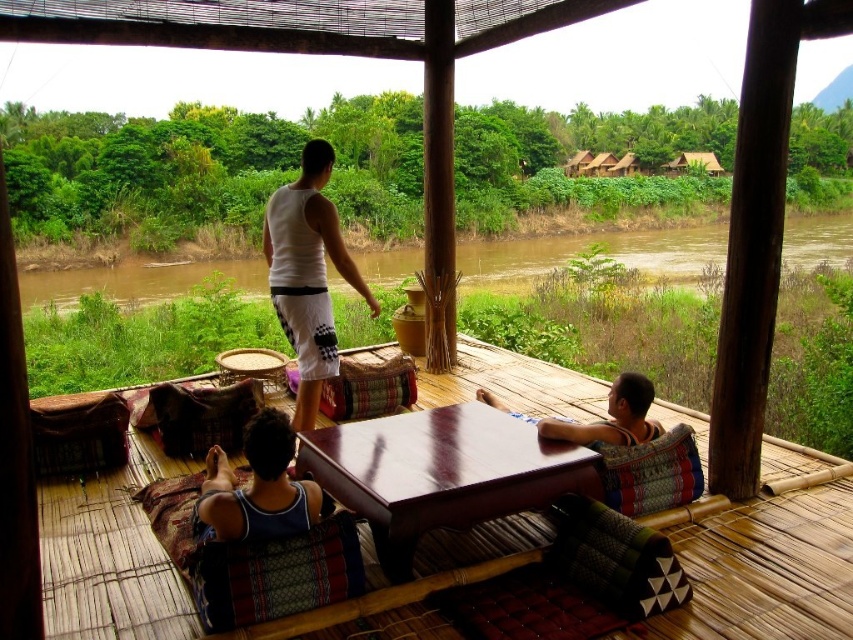
In the scene shown: Between mahogany wood table at center and brown muddy water at center, which one has more height?

With more height is brown muddy water at center.

Where is `mahogany wood table at center`? The width and height of the screenshot is (853, 640). mahogany wood table at center is located at coordinates (440, 472).

Identify the location of mahogany wood table at center. The height and width of the screenshot is (640, 853). (440, 472).

Does mahogany wood table at center appear under blue fabric at lower left?

Actually, mahogany wood table at center is above blue fabric at lower left.

Locate an element on the screen. This screenshot has width=853, height=640. mahogany wood table at center is located at coordinates (440, 472).

Does wooden table at center have a greater height compared to matte brown fabric at right?

Incorrect, wooden table at center's height is not larger of matte brown fabric at right's.

Can you confirm if wooden table at center is shorter than matte brown fabric at right?

Indeed, wooden table at center has a lesser height compared to matte brown fabric at right.

Which is behind, point (830, 573) or point (612, 390)?

The point (612, 390) is behind.

This screenshot has height=640, width=853. I want to click on wooden table at center, so click(764, 566).